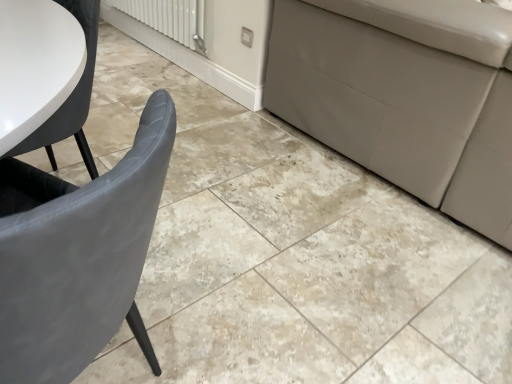
Question: Relative to matte gray chair at left, is white glossy radiator at upper center in front or behind?

Choices:
 (A) front
 (B) behind

Answer: (B)

Question: Considering the positions of white glossy radiator at upper center and matte gray chair at left in the image, is white glossy radiator at upper center bigger or smaller than matte gray chair at left?

Choices:
 (A) big
 (B) small

Answer: (B)

Question: From the image's perspective, relative to matte gray chair at left, is white glossy radiator at upper center above or below?

Choices:
 (A) below
 (B) above

Answer: (B)

Question: In terms of width, does matte gray chair at left look wider or thinner when compared to white glossy radiator at upper center?

Choices:
 (A) thin
 (B) wide

Answer: (B)

Question: Is matte gray chair at left bigger or smaller than white glossy radiator at upper center?

Choices:
 (A) small
 (B) big

Answer: (B)

Question: Is point (160, 152) positioned closer to the camera than point (202, 51)?

Choices:
 (A) closer
 (B) farther

Answer: (A)

Question: From the image's perspective, relative to white glossy radiator at upper center, is matte gray chair at left above or below?

Choices:
 (A) below
 (B) above

Answer: (A)